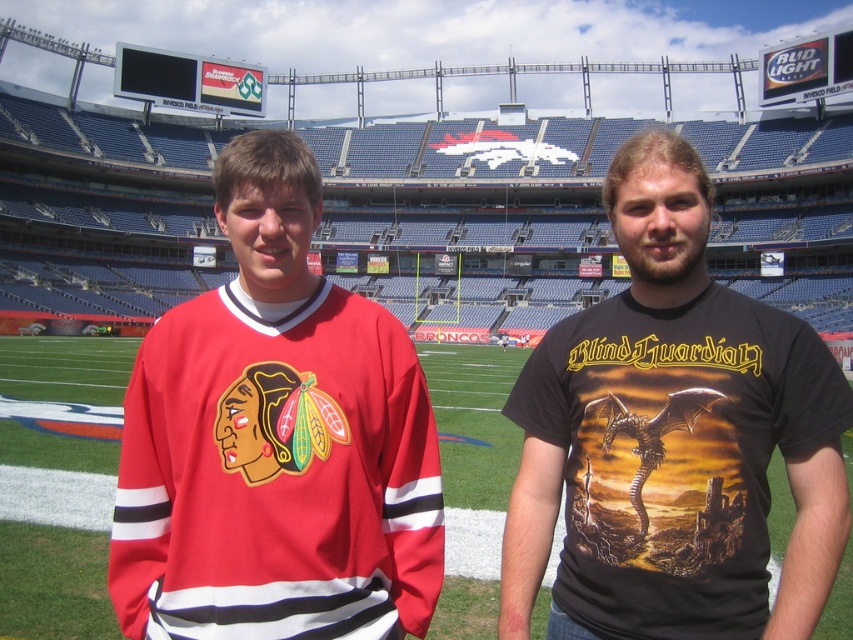
You are a photographer at the stadium and want to capture both the matte jersey at center and the green grass football field at center in a single shot. Considering their sizes, which object would you need to position closer to the camera to ensure both are visible in the frame?

The matte jersey at center has a smaller size compared to the green grass football field at center. To ensure both are visible in the frame, you should position the matte jersey at center closer to the camera so its size in the photo matches the scale of the green grass football field at center in the background.